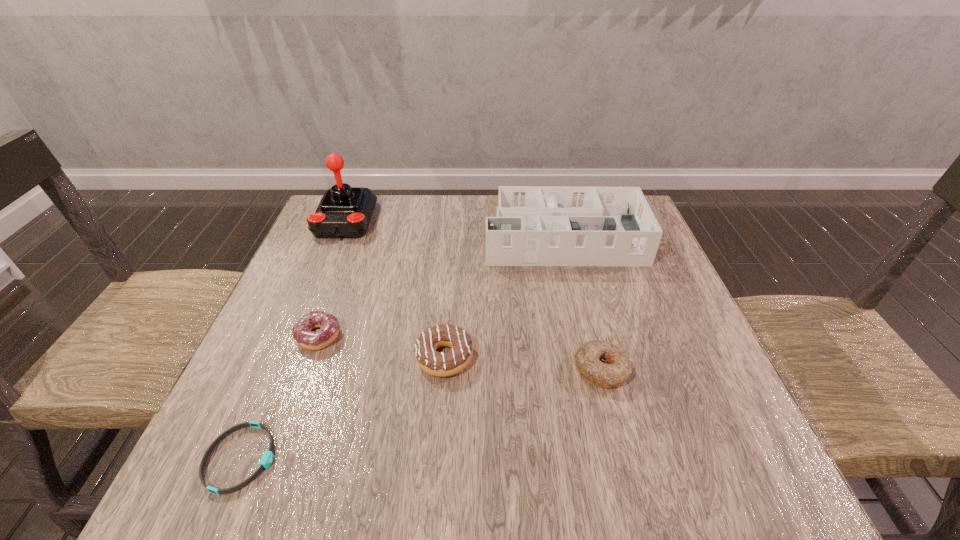
Locate an element on the screen. The width and height of the screenshot is (960, 540). vacant space situated on the left of the rightmost doughnut is located at coordinates (448, 370).

You are a GUI agent. You are given a task and a screenshot of the screen. Output one action in this format:
    pyautogui.click(x=<x>, y=<y>)
    Task: Click on the vacant point located 0.080m on the right of the leftmost doughnut
    The width and height of the screenshot is (960, 540).
    Given the screenshot: What is the action you would take?
    pyautogui.click(x=380, y=336)

Where is `vacant space located on the buckle of the shortest object`? The image size is (960, 540). vacant space located on the buckle of the shortest object is located at coordinates (497, 458).

Find the location of a particular element. The image size is (960, 540). joystick positioned at the far edge is located at coordinates (344, 212).

This screenshot has width=960, height=540. I want to click on dollhouse present at the far edge, so click(x=535, y=225).

The height and width of the screenshot is (540, 960). What are the coordinates of `object located in the near edge section of the desktop` in the screenshot? It's located at (267, 458).

Where is `joystick that is at the left edge`? The image size is (960, 540). joystick that is at the left edge is located at coordinates (344, 212).

Locate an element on the screen. The height and width of the screenshot is (540, 960). doughnut that is positioned at the left edge is located at coordinates (329, 326).

You are a GUI agent. You are given a task and a screenshot of the screen. Output one action in this format:
    pyautogui.click(x=<x>, y=<y>)
    Task: Click on the wristband located at the left edge
    
    Given the screenshot: What is the action you would take?
    pyautogui.click(x=267, y=458)

Locate an element on the screen. The height and width of the screenshot is (540, 960). object situated at the right edge is located at coordinates (535, 225).